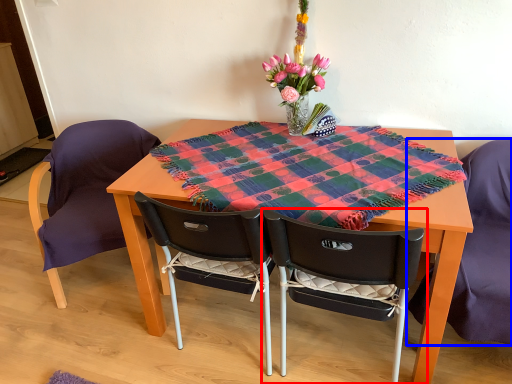
Question: Among these objects, which one is farthest to the camera, chair (highlighted by a red box) or chair (highlighted by a blue box)?

Choices:
 (A) chair
 (B) chair

Answer: (B)